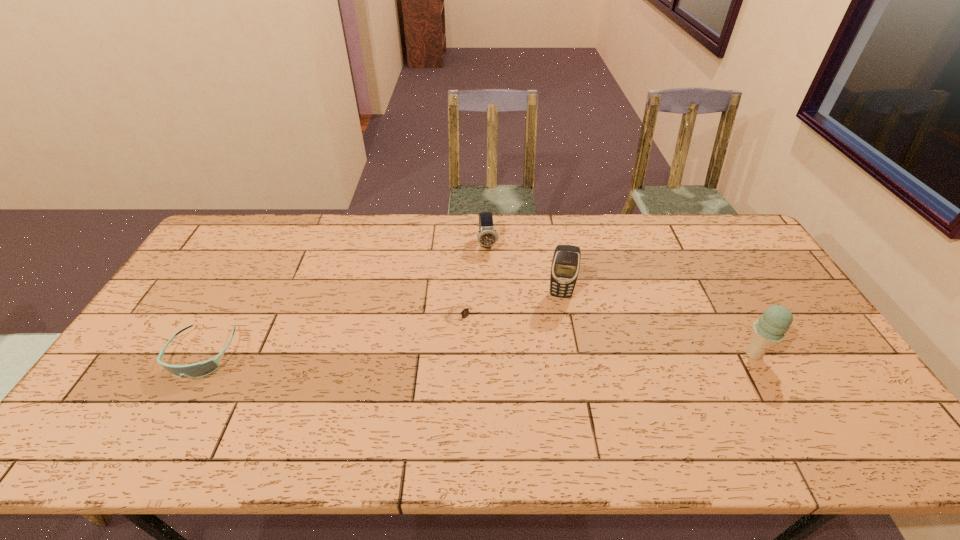
Where is `the leftmost object`? The height and width of the screenshot is (540, 960). the leftmost object is located at coordinates (200, 369).

You are a GUI agent. You are given a task and a screenshot of the screen. Output one action in this format:
    pyautogui.click(x=<x>, y=<y>)
    Task: Click on the second shortest object
    The height and width of the screenshot is (540, 960).
    Given the screenshot: What is the action you would take?
    pyautogui.click(x=200, y=369)

At what (x,y) coordinates should I click in order to perform the action: click on ice cream. Please return your answer as a coordinate pair (x, y). The width and height of the screenshot is (960, 540). Looking at the image, I should click on (770, 329).

Find the location of `the farthest object`. the farthest object is located at coordinates (486, 236).

At what (x,y) coordinates should I click in order to perform the action: click on the taller watch. Please return your answer as a coordinate pair (x, y). The height and width of the screenshot is (540, 960). Looking at the image, I should click on (486, 236).

Find the location of a particular element. This screenshot has height=540, width=960. the nearer watch is located at coordinates (460, 312).

Where is `the shortest object`? This screenshot has height=540, width=960. the shortest object is located at coordinates (460, 312).

I want to click on the fourth object from left to right, so click(565, 266).

This screenshot has height=540, width=960. I want to click on vacant space located 0.070m on the front-facing side of the goggles, so click(x=173, y=406).

Where is `blank space located 0.130m on the front of the ice cream`? blank space located 0.130m on the front of the ice cream is located at coordinates (785, 411).